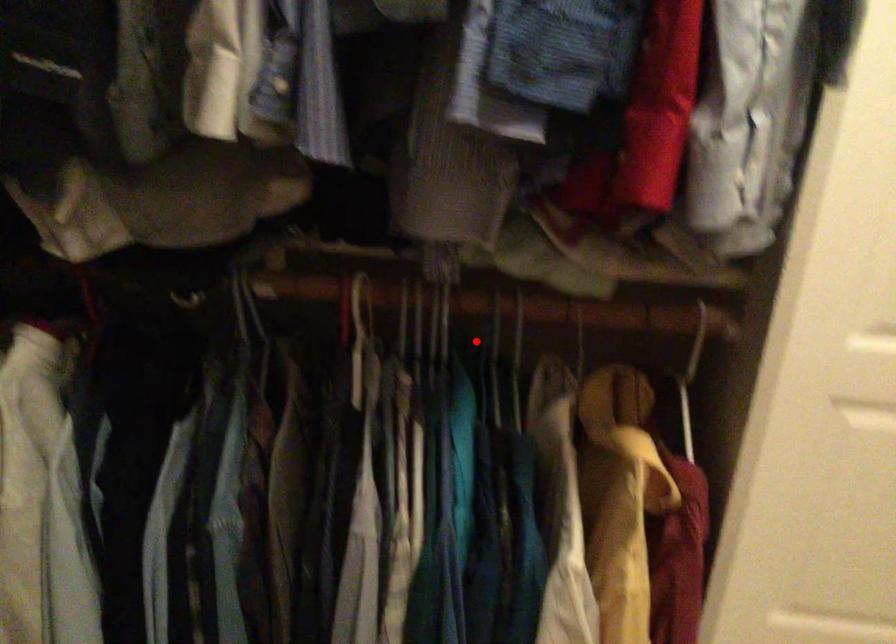
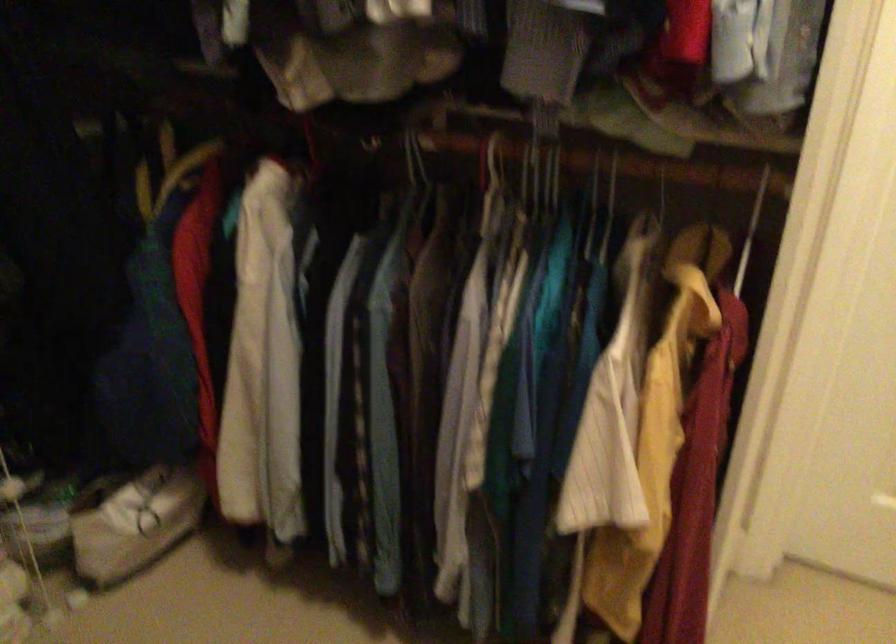
Question: I am providing you with two images of the same scene from different viewpoints. Image1 has a red point marked. In image2, the corresponding 3D location appears at what relative position? Reply with the corresponding letter.

Choices:
 (A) Closer
 (B) Farther

Answer: (B)